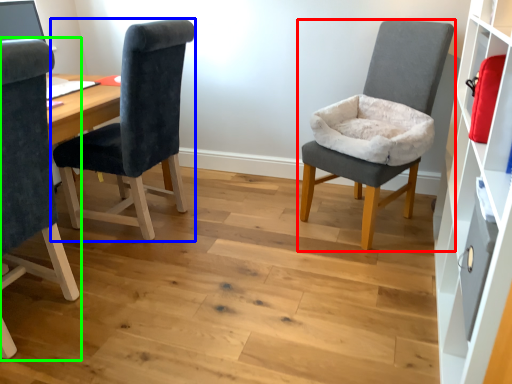
Question: Which is farther away from chair (highlighted by a red box)? chair (highlighted by a blue box) or chair (highlighted by a green box)?

Choices:
 (A) chair
 (B) chair

Answer: (B)